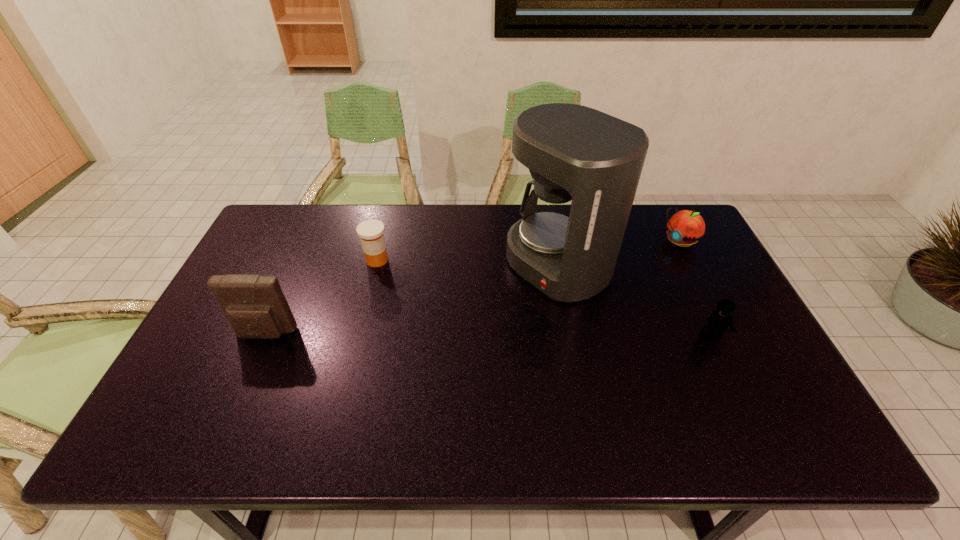
Find the location of a particular element. object present at the left edge is located at coordinates (255, 306).

Locate an element on the screen. Image resolution: width=960 pixels, height=540 pixels. Lego that is positioned at the right edge is located at coordinates (721, 319).

Where is `apple located in the right edge section of the desktop`? apple located in the right edge section of the desktop is located at coordinates (685, 227).

Identify the location of object located in the far right corner section of the desktop. The width and height of the screenshot is (960, 540). (685, 227).

In the image, there is a desktop. Where is `blank space at the far edge`? Image resolution: width=960 pixels, height=540 pixels. blank space at the far edge is located at coordinates (434, 205).

The height and width of the screenshot is (540, 960). What are the coordinates of `free space at the near edge of the desktop` in the screenshot? It's located at (x=639, y=395).

Image resolution: width=960 pixels, height=540 pixels. In the image, there is a desktop. Find the location of `blank space at the left edge`. blank space at the left edge is located at coordinates (265, 266).

Where is `vacant area at the right edge`? vacant area at the right edge is located at coordinates (701, 326).

This screenshot has width=960, height=540. Find the location of `vacant space at the far left corner`. vacant space at the far left corner is located at coordinates (313, 215).

This screenshot has width=960, height=540. Find the location of `free location at the far right corner of the desktop`. free location at the far right corner of the desktop is located at coordinates (670, 213).